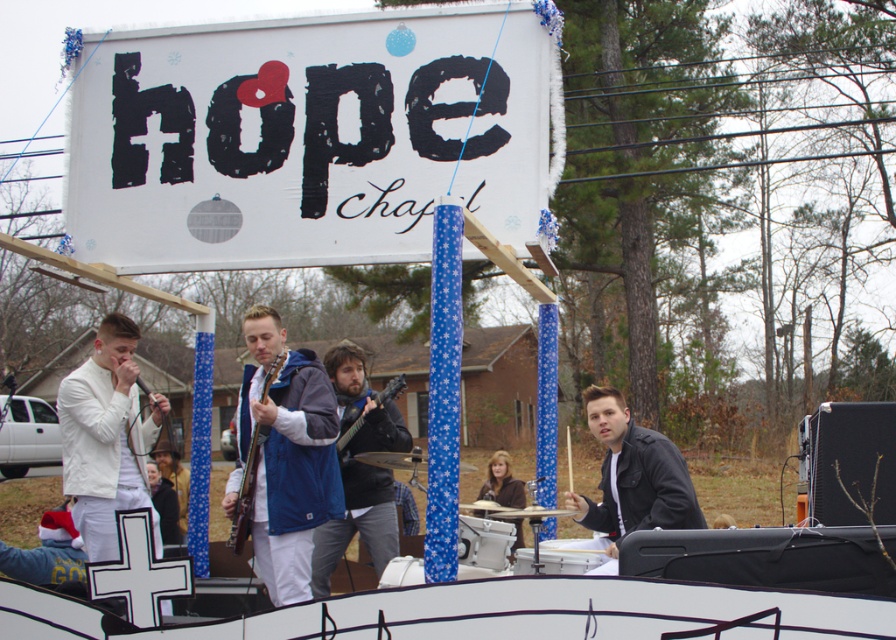
Question: Does brown fuzzy jacket at center have a lesser width compared to dark brown leather jacket at center?

Choices:
 (A) no
 (B) yes

Answer: (B)

Question: Which of the following is the closest to the observer?

Choices:
 (A) (360, 492)
 (B) (174, 490)
 (C) (65, 468)

Answer: (C)

Question: Is wooden acoustic guitar at center wider than black matte guitar at center?

Choices:
 (A) no
 (B) yes

Answer: (A)

Question: Can you confirm if brown fuzzy jacket at center is bigger than wooden guitar at center?

Choices:
 (A) no
 (B) yes

Answer: (B)

Question: Which point is closer to the camera?

Choices:
 (A) shiny silver cymbal at center
 (B) dark brown leather jacket at center

Answer: (A)

Question: Among these points, which one is farthest from the camera?

Choices:
 (A) (279, 456)
 (B) (174, 529)
 (C) (626, 465)

Answer: (B)